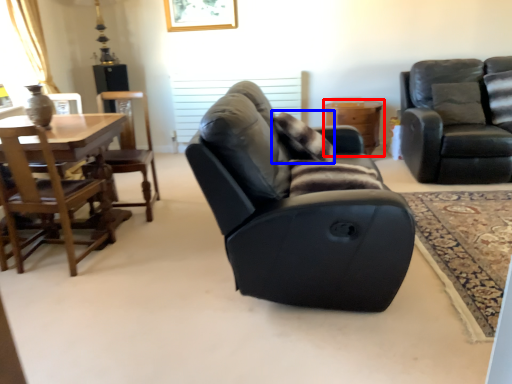
Question: Which object is closer to the camera taking this photo, table (highlighted by a red box) or pillow (highlighted by a blue box)?

Choices:
 (A) table
 (B) pillow

Answer: (B)